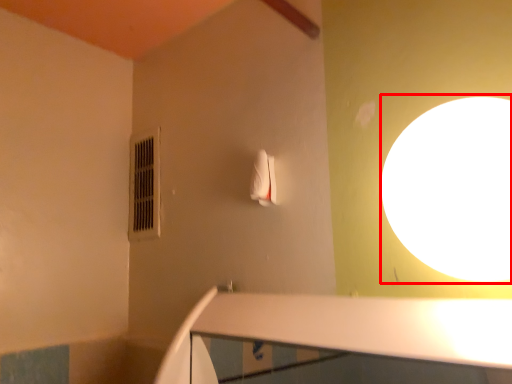
Question: From the image's perspective, considering the relative positions of light (annotated by the red box) and air conditioner in the image provided, where is light (annotated by the red box) located with respect to the staircase?

Choices:
 (A) below
 (B) above

Answer: (A)